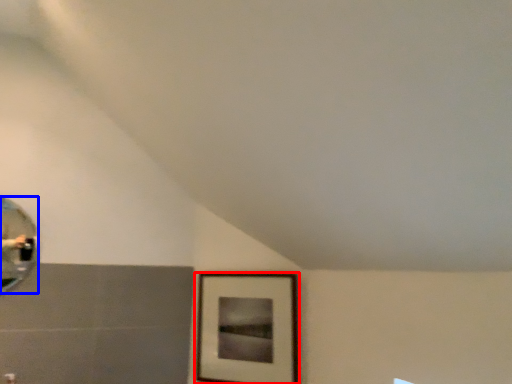
Question: Which object is closer to the camera taking this photo, picture frame (highlighted by a red box) or mirror (highlighted by a blue box)?

Choices:
 (A) picture frame
 (B) mirror

Answer: (B)